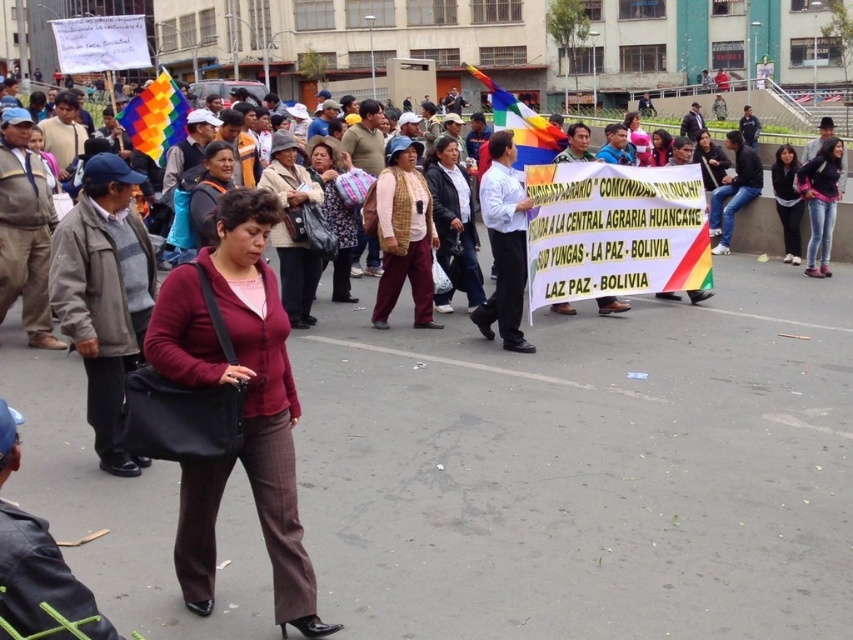
In the scene shown: You are a photographer at the protest event. You have to take a photo of the jeans at center and knitted sweater at center. Which clothing item is covering the other one?

The jeans at center is positioned over knitted sweater at center, so the jeans at center is covering the knitted sweater at center.

You are a photographer standing at the edge of the crowd. You want to capture a photo that includes both the knitted sweater at center and the dark blue jeans at upper right. Given that your camera has a maximum focus range of 20 feet, will you be able to include both subjects in the same frame without moving closer?

The distance between the knitted sweater at center and the dark blue jeans at upper right is 21.84 feet, which exceeds the camera maximum focus range of 20 feet. Therefore, you cannot include both subjects in the same frame without moving closer.

You are a photographer trying to capture the knitted sweater at center and the dark blue jeans at upper right in a single frame. Based on their sizes, which object would appear wider in the photo?

The knitted sweater at center would appear wider in the photo since its width surpasses that of the dark blue jeans at upper right.